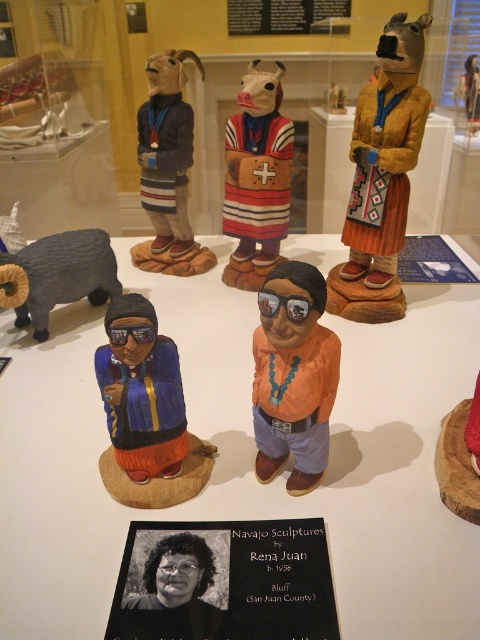
Which is above, black paper at center or gray matte ram at lower left?

gray matte ram at lower left is above.

How distant is black paper at center from gray matte ram at lower left?

black paper at center and gray matte ram at lower left are 3.71 feet apart from each other.

Locate an element on the screen. This screenshot has height=640, width=480. black paper at center is located at coordinates (225, 580).

You are a GUI agent. You are given a task and a screenshot of the screen. Output one action in this format:
    pyautogui.click(x=<x>, y=<y>)
    Task: Click on the black paper at center
    The image size is (480, 640).
    Given the screenshot: What is the action you would take?
    pyautogui.click(x=225, y=580)

Who is higher up, matte painted wooden kachina at center or gray matte ram at lower left?

matte painted wooden kachina at center is above.

Which of these two, matte painted wooden kachina at center or gray matte ram at lower left, stands shorter?

Standing shorter between the two is gray matte ram at lower left.

Between point (255, 173) and point (43, 237), which one is positioned behind?

Point (43, 237)

Locate an element on the screen. Image resolution: width=480 pixels, height=640 pixels. matte painted wooden kachina at center is located at coordinates click(256, 177).

Can you confirm if orange matte kachina at center is shorter than matte brown kachina doll at upper right?

Indeed, orange matte kachina at center has a lesser height compared to matte brown kachina doll at upper right.

Who is more forward, (262,451) or (383,240)?

Point (262,451) is in front.

In order to click on orange matte kachina at center in this screenshot , I will do `click(292, 376)`.